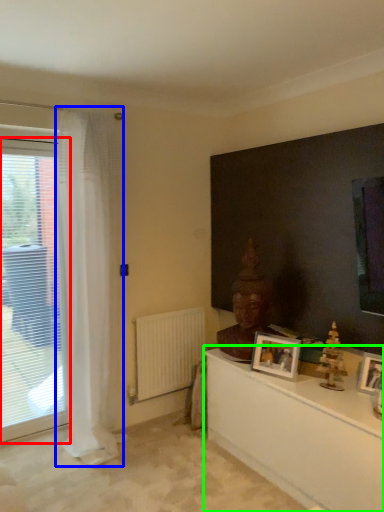
Question: Which is farther away from window (highlighted by a red box)? curtain (highlighted by a blue box) or table (highlighted by a green box)?

Choices:
 (A) curtain
 (B) table

Answer: (B)